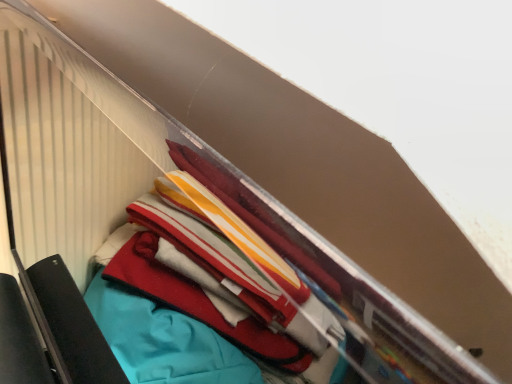
The height and width of the screenshot is (384, 512). In order to click on striped cotton towel at center in this screenshot , I will do 247,288.

Describe the element at coordinates (247, 288) in the screenshot. I see `striped cotton towel at center` at that location.

What is the approximate height of striped cotton towel at center?

The height of striped cotton towel at center is 64.88 centimeters.

Identify the location of striped cotton towel at center. The image size is (512, 384). (247, 288).